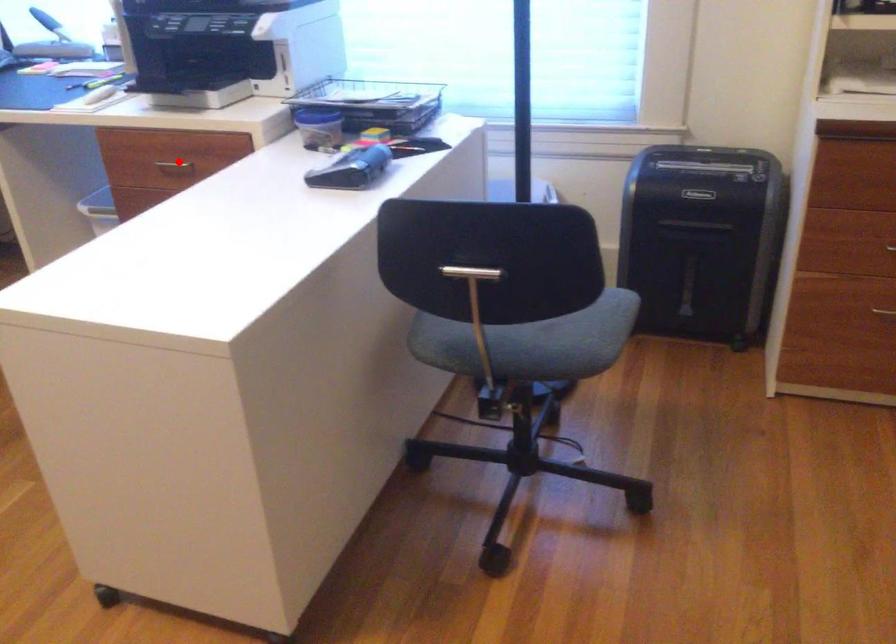
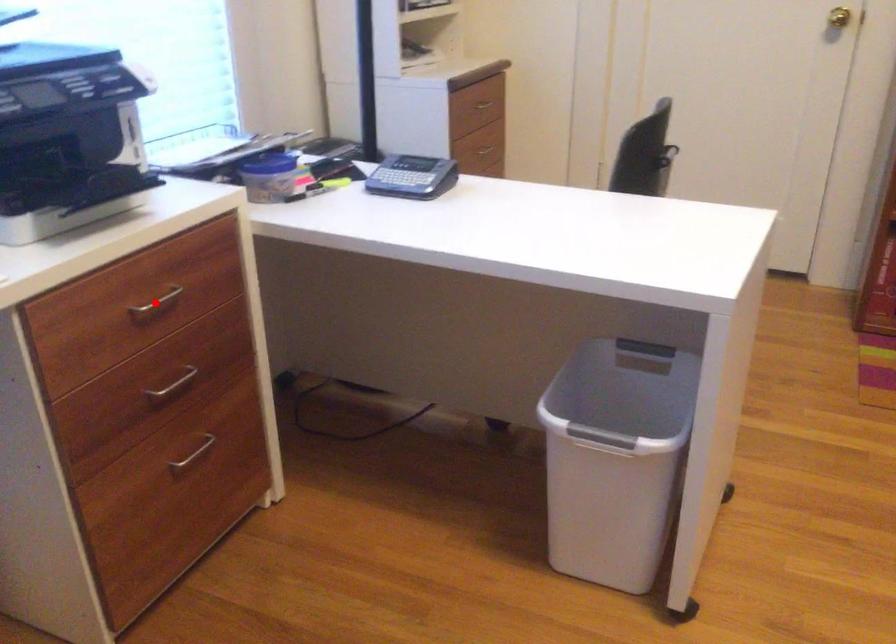
I am providing you with two images of the same scene from different viewpoints. A red point is marked on the first image and another point is marked on the second image. Do the highlighted points in image1 and image2 indicate the same real-world spot?

Yes